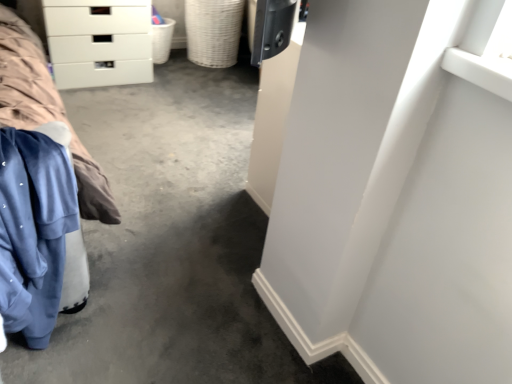
What is the approximate height of white glossy chest of drawers at upper left?

20.40 inches.

At what (x,y) coordinates should I click in order to perform the action: click on blue fleece at left. Please return your answer as a coordinate pair (x, y). Looking at the image, I should click on (41, 192).

From the image's perspective, between blue fleece at left and woven beige basket at center, the second basket viewed from the left, who is located below?

blue fleece at left is shown below in the image.

In the scene shown: Can you confirm if blue fleece at left is smaller than woven beige basket at center, the second basket viewed from the left?

Yes.

From the picture: Which object is positioned more to the left, blue fleece at left or woven beige basket at center, the second basket viewed from the left?

From the viewer's perspective, blue fleece at left appears more on the left side.

You are a GUI agent. You are given a task and a screenshot of the screen. Output one action in this format:
    pyautogui.click(x=<x>, y=<y>)
    Task: Click on the bed lying below the woven beige basket at center, which is counted as the first basket, starting from the right (from the image's perspective)
    This screenshot has width=512, height=384.
    Given the screenshot: What is the action you would take?
    pyautogui.click(x=41, y=192)

Does white plastic basket at upper left, the 1th basket in the left-to-right sequence, appear on the right side of woven beige basket at center, which is counted as the first basket, starting from the right?

In fact, white plastic basket at upper left, the 1th basket in the left-to-right sequence, is to the left of woven beige basket at center, which is counted as the first basket, starting from the right.

From the picture: From the image's perspective, is white plastic basket at upper left, the 1th basket in the left-to-right sequence, located above or below woven beige basket at center, which is counted as the first basket, starting from the right?

Clearly, from the image's perspective, white plastic basket at upper left, the 1th basket in the left-to-right sequence, is below woven beige basket at center, which is counted as the first basket, starting from the right.

Which is behind, white plastic basket at upper left, the 1th basket in the left-to-right sequence, or woven beige basket at center, which is counted as the first basket, starting from the right?

white plastic basket at upper left, the 1th basket in the left-to-right sequence, is more distant.

Can you confirm if white plastic basket at upper left, which is the 2th basket from right to left, is shorter than woven beige basket at center, which is counted as the first basket, starting from the right?

Yes.

Are white plastic basket at upper left, which is the 2th basket from right to left, and blue fleece at left making contact?

No, white plastic basket at upper left, which is the 2th basket from right to left, is not beside blue fleece at left.

Does point (158, 25) appear closer or farther from the camera than point (18, 187)?

Point (158, 25) is farther from the camera than point (18, 187).

Considering the sizes of white plastic basket at upper left, the 1th basket in the left-to-right sequence, and blue fleece at left in the image, is white plastic basket at upper left, the 1th basket in the left-to-right sequence, wider or thinner than blue fleece at left?

Clearly, white plastic basket at upper left, the 1th basket in the left-to-right sequence, has less width compared to blue fleece at left.

Consider the image. Considering the sizes of white plastic basket at upper left, the 1th basket in the left-to-right sequence, and blue fleece at left in the image, is white plastic basket at upper left, the 1th basket in the left-to-right sequence, bigger or smaller than blue fleece at left?

Considering their sizes, white plastic basket at upper left, the 1th basket in the left-to-right sequence, takes up less space than blue fleece at left.

Which is correct: white plastic basket at upper left, which is the 2th basket from right to left, is inside white glossy chest of drawers at upper left, or outside of it?

white plastic basket at upper left, which is the 2th basket from right to left, is not inside white glossy chest of drawers at upper left, it's outside.

From the image's perspective, starting from the white glossy chest of drawers at upper left, which basket is the 1st one above? Please provide its 2D coordinates.

[(162, 40)]

Which object is wider, white plastic basket at upper left, the 1th basket in the left-to-right sequence, or white glossy chest of drawers at upper left?

Wider between the two is white glossy chest of drawers at upper left.

Can you confirm if white glossy chest of drawers at upper left is wider than white plastic basket at upper left, which is the 2th basket from right to left?

Indeed, white glossy chest of drawers at upper left has a greater width compared to white plastic basket at upper left, which is the 2th basket from right to left.

Based on the photo, which of these two, white glossy chest of drawers at upper left or white plastic basket at upper left, which is the 2th basket from right to left, is bigger?

white glossy chest of drawers at upper left.

From a real-world perspective, relative to white plastic basket at upper left, the 1th basket in the left-to-right sequence, is white glossy chest of drawers at upper left vertically above or below?

→ white glossy chest of drawers at upper left is situated higher than white plastic basket at upper left, the 1th basket in the left-to-right sequence, in the real world.

How many degrees apart are the facing directions of white glossy chest of drawers at upper left and white plastic basket at upper left, which is the 2th basket from right to left?

They differ by 0.000456 degrees in their facing directions.

From their relative heights in the image, would you say woven beige basket at center, the second basket viewed from the left, is taller or shorter than blue fleece at left?

In the image, woven beige basket at center, the second basket viewed from the left, appears to be shorter than blue fleece at left.

Does point (215, 25) lie in front of point (42, 291)?

No.

Considering the relative sizes of woven beige basket at center, the second basket viewed from the left, and blue fleece at left in the image provided, is woven beige basket at center, the second basket viewed from the left, thinner than blue fleece at left?

In fact, woven beige basket at center, the second basket viewed from the left, might be wider than blue fleece at left.

Which object is further away from the camera taking this photo, woven beige basket at center, the second basket viewed from the left, or blue fleece at left?

woven beige basket at center, the second basket viewed from the left.

How different are the orientations of woven beige basket at center, which is counted as the first basket, starting from the right, and white plastic basket at upper left, which is the 2th basket from right to left, in degrees?

The angular difference between woven beige basket at center, which is counted as the first basket, starting from the right, and white plastic basket at upper left, which is the 2th basket from right to left, is 0.000225 degrees.

In the scene shown: Is woven beige basket at center, which is counted as the first basket, starting from the right, closer to camera compared to white plastic basket at upper left, the 1th basket in the left-to-right sequence?

Yes.

Which is in front, point (196, 12) or point (159, 44)?

Point (159, 44)

Consider the image. From the image's perspective, is woven beige basket at center, the second basket viewed from the left, on top of white plastic basket at upper left, the 1th basket in the left-to-right sequence?

Yes, from the image's perspective, woven beige basket at center, the second basket viewed from the left, is above white plastic basket at upper left, the 1th basket in the left-to-right sequence.

The image size is (512, 384). What are the coordinates of `bed below the woven beige basket at center, the second basket viewed from the left (from the image's perspective)` in the screenshot? It's located at (41, 192).

This screenshot has width=512, height=384. Find the location of `basket on the right of the white plastic basket at upper left, the 1th basket in the left-to-right sequence`. basket on the right of the white plastic basket at upper left, the 1th basket in the left-to-right sequence is located at coordinates (213, 31).

Looking at the image, which one is located closer to white glossy chest of drawers at upper left, blue fleece at left or white plastic basket at upper left, which is the 2th basket from right to left?

Among the two, white plastic basket at upper left, which is the 2th basket from right to left, is located nearer to white glossy chest of drawers at upper left.

Which object lies further to the anchor point white glossy chest of drawers at upper left, blue fleece at left or woven beige basket at center, the second basket viewed from the left?

The object further to white glossy chest of drawers at upper left is blue fleece at left.

Estimate the real-world distances between objects in this image. Which object is further from white glossy chest of drawers at upper left, woven beige basket at center, the second basket viewed from the left, or blue fleece at left?

The object further to white glossy chest of drawers at upper left is blue fleece at left.

From the image, which object appears to be nearer to white glossy chest of drawers at upper left, white plastic basket at upper left, which is the 2th basket from right to left, or woven beige basket at center, the second basket viewed from the left?

white plastic basket at upper left, which is the 2th basket from right to left, is positioned closer to the anchor white glossy chest of drawers at upper left.

Looking at the image, which one is located closer to blue fleece at left, white plastic basket at upper left, the 1th basket in the left-to-right sequence, or woven beige basket at center, the second basket viewed from the left?

white plastic basket at upper left, the 1th basket in the left-to-right sequence, is closer to blue fleece at left.

When comparing their distances from blue fleece at left, does white plastic basket at upper left, the 1th basket in the left-to-right sequence, or white glossy chest of drawers at upper left seem further?

white plastic basket at upper left, the 1th basket in the left-to-right sequence, is further to blue fleece at left.

Looking at the image, which one is located further to woven beige basket at center, which is counted as the first basket, starting from the right, white glossy chest of drawers at upper left or blue fleece at left?

blue fleece at left lies further to woven beige basket at center, which is counted as the first basket, starting from the right, than the other object.

Considering their positions, is blue fleece at left positioned closer to woven beige basket at center, the second basket viewed from the left, than white glossy chest of drawers at upper left?

white glossy chest of drawers at upper left is closer to woven beige basket at center, the second basket viewed from the left.

Where is `basket located between blue fleece at left and white plastic basket at upper left, the 1th basket in the left-to-right sequence, in the depth direction`? basket located between blue fleece at left and white plastic basket at upper left, the 1th basket in the left-to-right sequence, in the depth direction is located at coordinates (213, 31).

Where is `chest of drawers between blue fleece at left and white plastic basket at upper left, which is the 2th basket from right to left, along the z-axis`? chest of drawers between blue fleece at left and white plastic basket at upper left, which is the 2th basket from right to left, along the z-axis is located at coordinates (99, 42).

Identify the location of basket situated between white glossy chest of drawers at upper left and woven beige basket at center, which is counted as the first basket, starting from the right, from left to right. This screenshot has width=512, height=384. (162, 40).

The image size is (512, 384). Identify the location of the chest of drawers located between blue fleece at left and woven beige basket at center, which is counted as the first basket, starting from the right, in the depth direction. (99, 42).